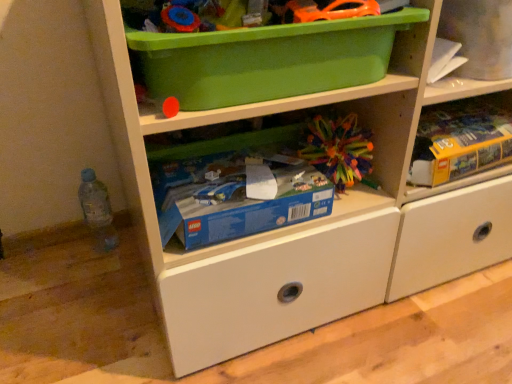
The image size is (512, 384). In order to click on vacant space in front of translucent plastic bottle at lower left in this screenshot , I will do `click(84, 290)`.